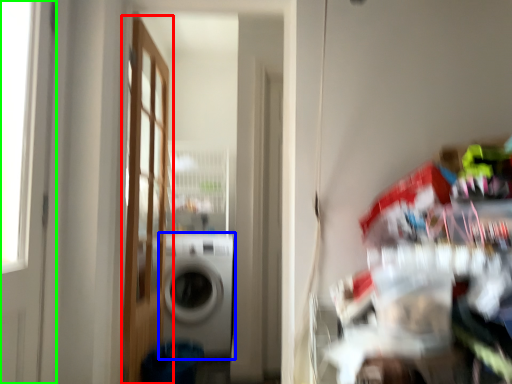
Question: Estimate the real-world distances between objects in this image. Which object is closer to door (highlighted by a red box), washing machine (highlighted by a blue box) or door (highlighted by a green box)?

Choices:
 (A) washing machine
 (B) door

Answer: (A)